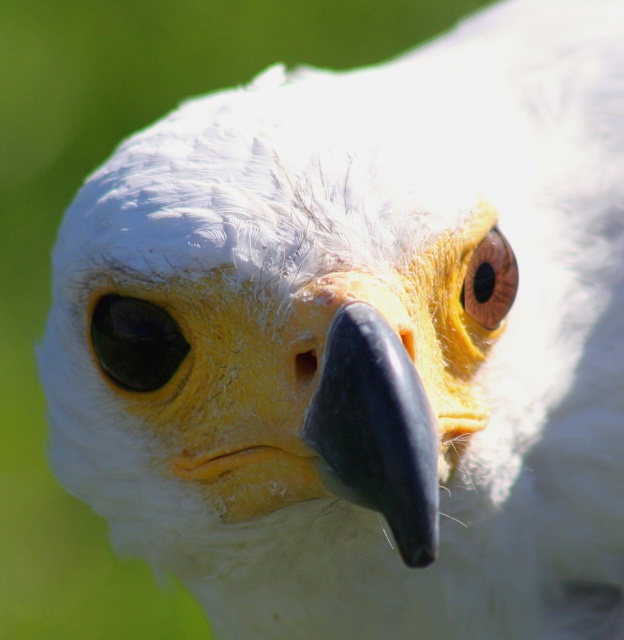
Who is shorter, shiny black eye at center or brown glossy eye at upper center?

shiny black eye at center

Who is positioned more to the left, shiny black eye at center or brown glossy eye at upper center?

shiny black eye at center

Does point (157, 324) lie behind point (499, 292)?

That is False.

This screenshot has height=640, width=624. What are the coordinates of `shiny black eye at center` in the screenshot? It's located at (135, 342).